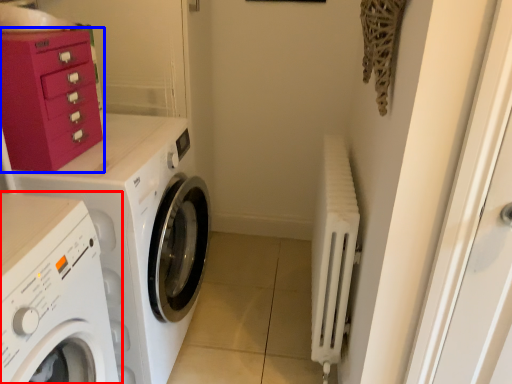
Question: Which point is further to the camera, washing machine (highlighted by a red box) or cabinetry (highlighted by a blue box)?

Choices:
 (A) washing machine
 (B) cabinetry

Answer: (B)